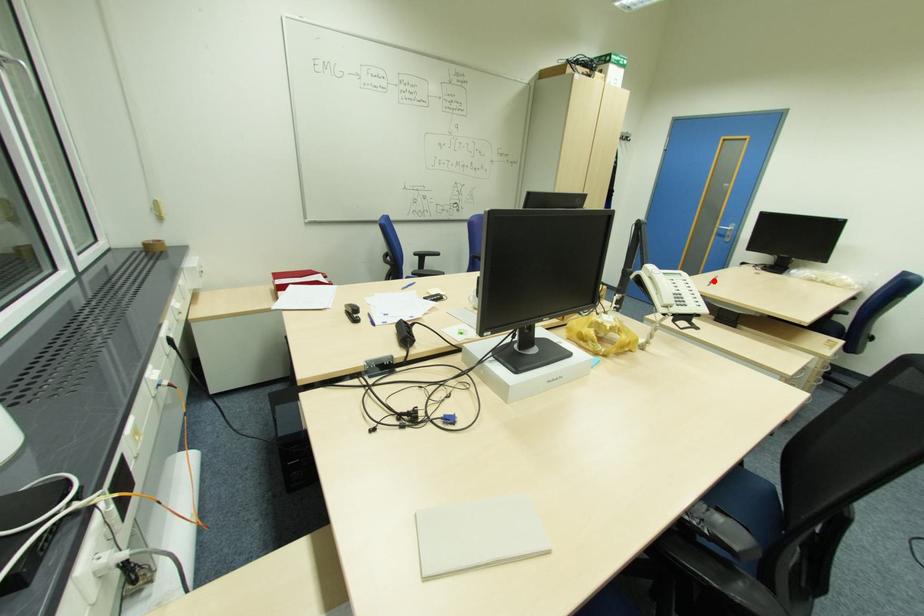
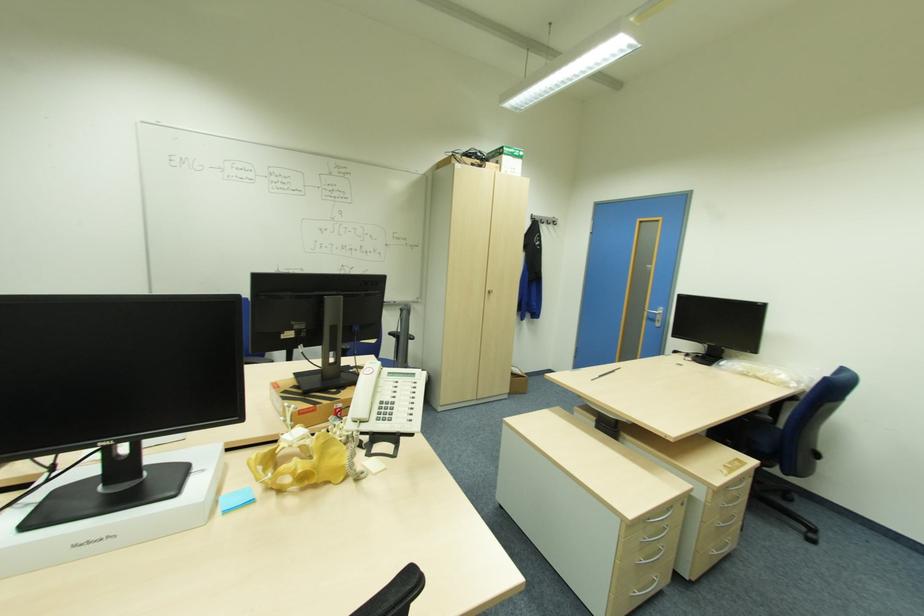
Locate, in the second image, the point that corresponds to the highlighted location in the first image.

(602, 374)